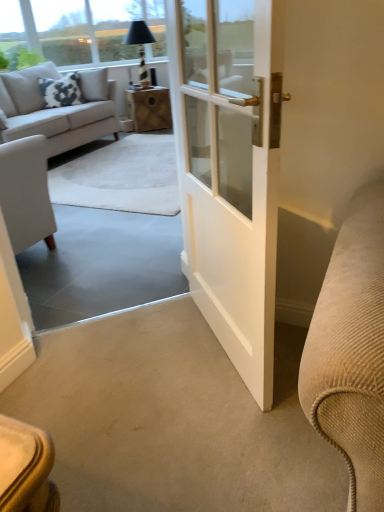
Question: Is white cotton pillow at upper left not close to light gray fabric couch at upper left?

Choices:
 (A) yes
 (B) no

Answer: (B)

Question: From a real-world perspective, is white cotton pillow at upper left below light gray fabric couch at upper left?

Choices:
 (A) no
 (B) yes

Answer: (A)

Question: Considering the relative sizes of white cotton pillow at upper left and light gray fabric couch at upper left in the image provided, is white cotton pillow at upper left thinner than light gray fabric couch at upper left?

Choices:
 (A) no
 (B) yes

Answer: (B)

Question: Is white cotton pillow at upper left positioned with its back to light gray fabric couch at upper left?

Choices:
 (A) no
 (B) yes

Answer: (B)

Question: Considering the relative sizes of white cotton pillow at upper left and light gray fabric couch at upper left in the image provided, is white cotton pillow at upper left shorter than light gray fabric couch at upper left?

Choices:
 (A) no
 (B) yes

Answer: (B)

Question: Is white cotton pillow at upper left at the right side of light gray fabric couch at upper left?

Choices:
 (A) yes
 (B) no

Answer: (A)

Question: Is light gray fabric couch at upper left to the right of black glass lamp at upper center from the viewer's perspective?

Choices:
 (A) yes
 (B) no

Answer: (B)

Question: Would you say light gray fabric couch at upper left is a long distance from black glass lamp at upper center?

Choices:
 (A) yes
 (B) no

Answer: (A)

Question: Considering the relative sizes of light gray fabric couch at upper left and black glass lamp at upper center in the image provided, is light gray fabric couch at upper left taller than black glass lamp at upper center?

Choices:
 (A) no
 (B) yes

Answer: (B)

Question: Is light gray fabric couch at upper left placed right next to black glass lamp at upper center?

Choices:
 (A) yes
 (B) no

Answer: (B)

Question: Is black glass lamp at upper center at the back of light gray fabric couch at upper left?

Choices:
 (A) yes
 (B) no

Answer: (B)

Question: From the image's perspective, would you say light gray fabric couch at upper left is shown under black glass lamp at upper center?

Choices:
 (A) no
 (B) yes

Answer: (B)

Question: From the image's perspective, is transparent glass window screen at upper left beneath wooden box at center?

Choices:
 (A) yes
 (B) no

Answer: (B)